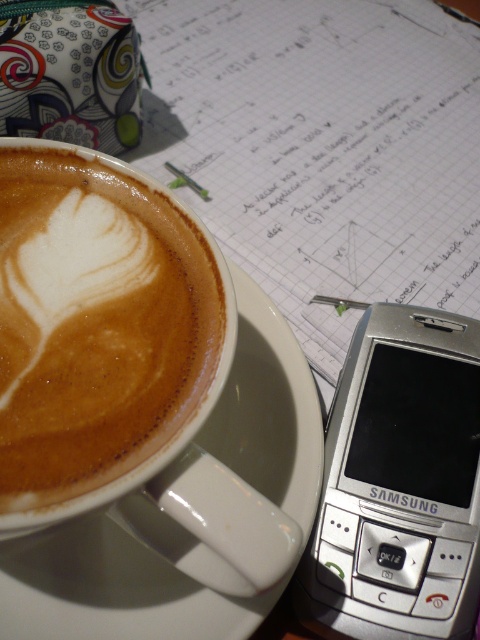
Question: Among these objects, which one is farthest from the camera?

Choices:
 (A) silver metallic samsung phone at upper right
 (B) latte art at upper left
 (C) white glossy saucer at upper center

Answer: (A)

Question: Which object is closer to the camera taking this photo?

Choices:
 (A) latte art at upper left
 (B) silver metallic samsung phone at upper right
 (C) white glossy saucer at upper center

Answer: (A)

Question: Can you confirm if latte art at upper left is smaller than white glossy saucer at upper center?

Choices:
 (A) yes
 (B) no

Answer: (A)

Question: Which point is farther to the camera?

Choices:
 (A) (275, 465)
 (B) (108, 467)

Answer: (A)

Question: Does latte art at upper left have a lesser width compared to white glossy saucer at upper center?

Choices:
 (A) yes
 (B) no

Answer: (A)

Question: Is latte art at upper left positioned behind silver metallic samsung phone at upper right?

Choices:
 (A) no
 (B) yes

Answer: (A)